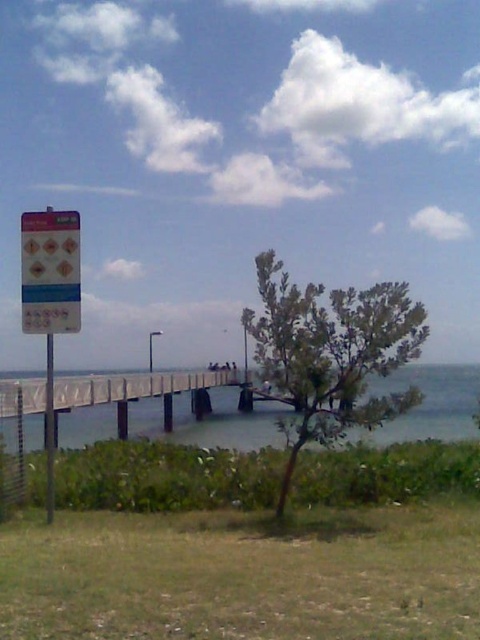
You are standing on the wooden pier and want to look down to see the clear blue water at center. Which direction should you look relative to the metallic pole at left?

The clear blue water at center is below the metallic pole at left, so you should look downward towards the metallic pole at left to see the clear blue water at center.

You are a tourist standing on the wooden dock at center. You want to read the text on the blue plastic sign at left. Which direction should you face to see the sign clearly?

The wooden dock at center is positioned under the blue plastic sign at left, so you should face upward to see the blue plastic sign at left clearly.

You are standing on the wooden pier and want to read the blue plastic sign at left. Is the sign visible from your current position?

Yes, the blue plastic sign at left is located at point (49, 272) which is on the left side of the image, so it should be visible from your position on the wooden pier.